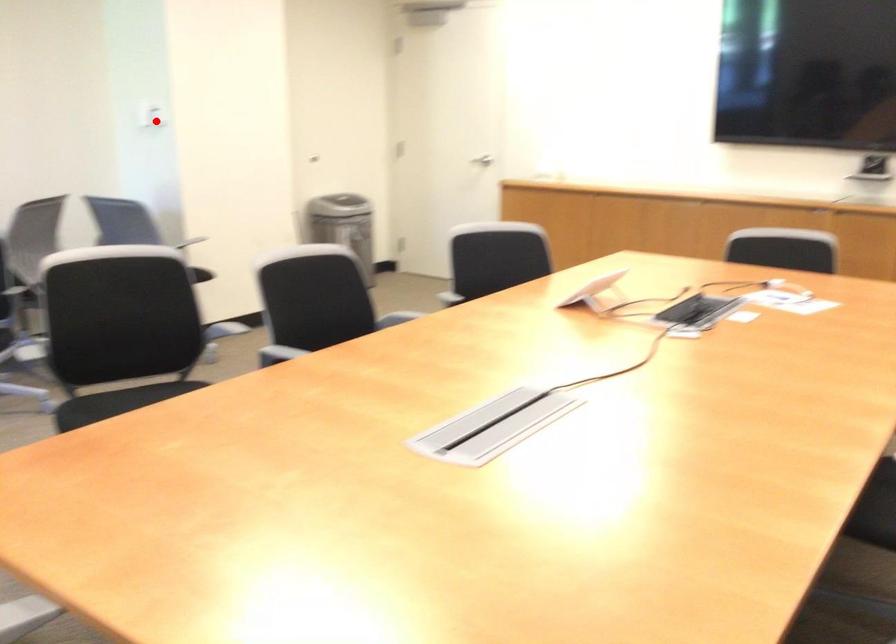
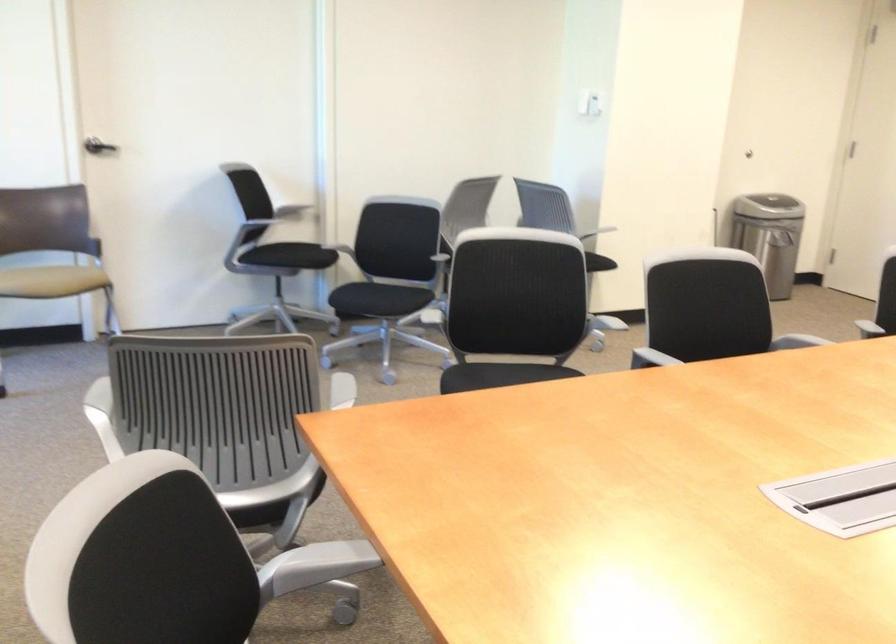
In the second image, find the point that corresponds to the highlighted location in the first image.

(590, 102)